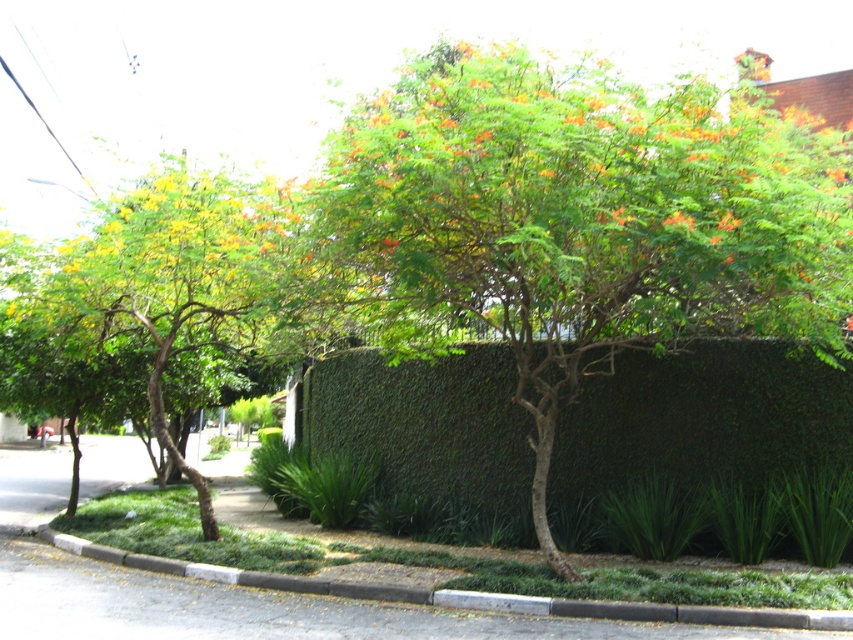
Consider the image. Can you confirm if green leafy hedge at center is wider than gray concrete curb at lower center?

Incorrect, green leafy hedge at center's width does not surpass gray concrete curb at lower center's.

Is green leafy hedge at center further to the viewer compared to gray concrete curb at lower center?

Yes, green leafy hedge at center is behind gray concrete curb at lower center.

The image size is (853, 640). Find the location of `green leafy hedge at center`. green leafy hedge at center is located at coordinates (699, 420).

Looking at this image, which is above, green leafy hedge at center or green leafy tree at left?

green leafy tree at left is above.

Between point (749, 433) and point (223, 344), which one is positioned behind?

Positioned behind is point (223, 344).

Is point (633, 385) closer to viewer compared to point (51, 326)?

No, (633, 385) is further to viewer.

At what (x,y) coordinates should I click in order to perform the action: click on green leafy hedge at center. Please return your answer as a coordinate pair (x, y). This screenshot has height=640, width=853. Looking at the image, I should click on (699, 420).

Can you confirm if green leafy tree at center is positioned to the right of green leafy tree at left?

Indeed, green leafy tree at center is positioned on the right side of green leafy tree at left.

Based on the photo, does green leafy tree at center come in front of green leafy tree at left?

Yes.

Is point (844, 344) in front of point (265, 268)?

No, (844, 344) is behind (265, 268).

Locate an element on the screen. The height and width of the screenshot is (640, 853). green leafy tree at center is located at coordinates (576, 224).